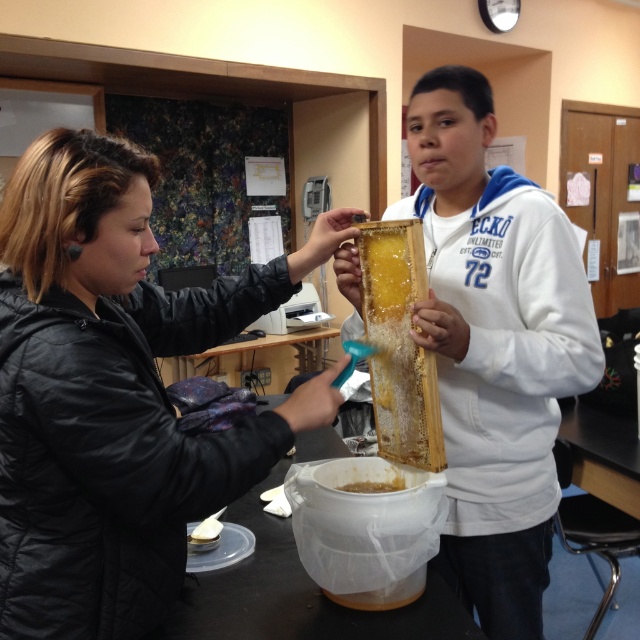
Between white cotton hoodie at center and yellow translucent honeycomb at center, which one has less height?

Standing shorter between the two is yellow translucent honeycomb at center.

Does white cotton hoodie at center have a larger size compared to yellow translucent honeycomb at center?

Correct, white cotton hoodie at center is larger in size than yellow translucent honeycomb at center.

Between point (493, 404) and point (392, 488), which one is positioned behind?

The point (392, 488) is more distant.

Find the location of a particular element. white cotton hoodie at center is located at coordinates (493, 346).

Can you confirm if translucent honeycomb at center is positioned below yellow translucent honeycomb at center?

Incorrect, translucent honeycomb at center is not positioned below yellow translucent honeycomb at center.

Does translucent honeycomb at center have a greater height compared to yellow translucent honeycomb at center?

Correct, translucent honeycomb at center is much taller as yellow translucent honeycomb at center.

Who is more distant from viewer, (404, 342) or (371, 490)?

The point (371, 490) is more distant.

This screenshot has height=640, width=640. In order to click on translucent honeycomb at center in this screenshot , I will do `click(400, 342)`.

This screenshot has width=640, height=640. What do you see at coordinates (116, 392) in the screenshot?
I see `black matte jacket at left` at bounding box center [116, 392].

Which of these two, black matte jacket at left or yellow translucent honeycomb at center, stands shorter?

yellow translucent honeycomb at center is shorter.

Which is behind, point (83, 596) or point (390, 481)?

Positioned behind is point (390, 481).

Identify the location of black matte jacket at left. This screenshot has height=640, width=640. (116, 392).